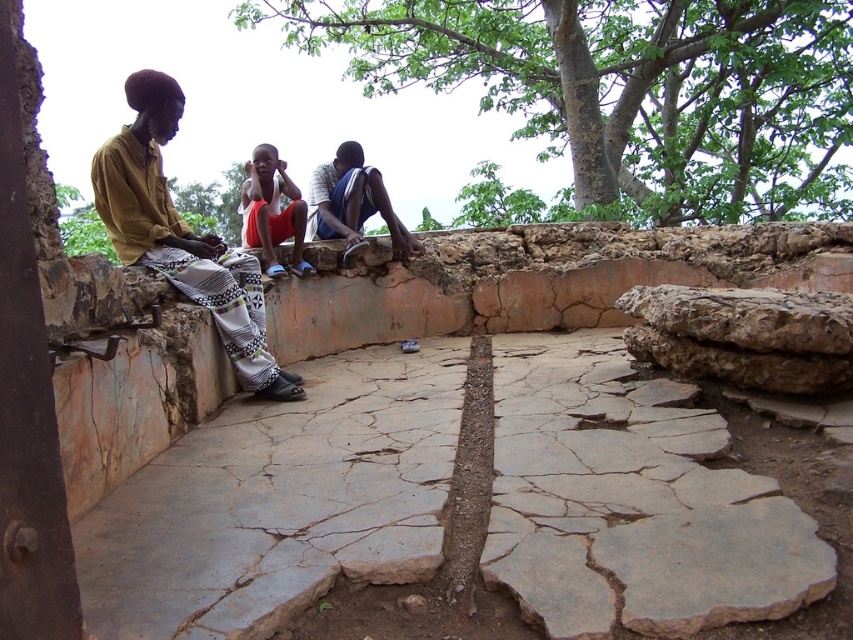
Question: Which of these objects is positioned closest to the yellow fabric pants at left?

Choices:
 (A) blue fabric shorts at center
 (B) orange cotton shorts at center
 (C) green leafy tree at upper center

Answer: (B)

Question: Among these objects, which one is farthest from the camera?

Choices:
 (A) orange cotton shorts at center
 (B) green leafy tree at upper center
 (C) blue fabric shorts at center

Answer: (B)

Question: Does green leafy tree at upper center lie behind orange cotton shorts at center?

Choices:
 (A) yes
 (B) no

Answer: (A)

Question: Is yellow fabric pants at left below blue fabric shorts at center?

Choices:
 (A) no
 (B) yes

Answer: (B)

Question: Where is yellow fabric pants at left located in relation to blue fabric shorts at center in the image?

Choices:
 (A) above
 (B) below

Answer: (B)

Question: Which object appears farthest from the camera in this image?

Choices:
 (A) green leafy tree at upper center
 (B) orange cotton shorts at center

Answer: (A)